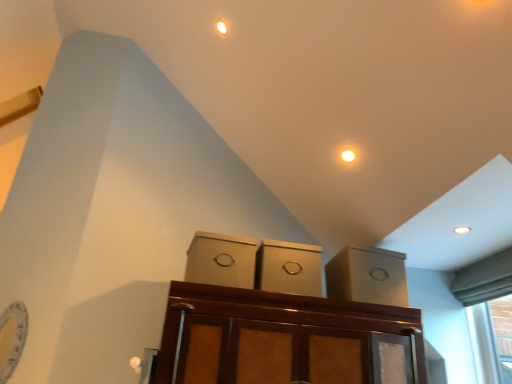
Question: Looking at their shapes, would you say matte cardboard box at center, the 3th cabinetry viewed from the right, is wider or thinner than matte cardboard boxes at center, arranged as the 2th cabinetry when viewed from the left?

Choices:
 (A) wide
 (B) thin

Answer: (B)

Question: Is point (196, 246) closer or farther from the camera than point (270, 263)?

Choices:
 (A) farther
 (B) closer

Answer: (A)

Question: Based on their relative distances, which object is nearer to the matte cardboard box at center, acting as the third cabinetry starting from the left?

Choices:
 (A) matte cardboard boxes at center, arranged as the 2th cabinetry when viewed from the left
 (B) matte cardboard box at center, acting as the first cabinetry starting from the left

Answer: (A)

Question: Estimate the real-world distances between objects in this image. Which object is farther from the matte cardboard box at center, acting as the third cabinetry starting from the left?

Choices:
 (A) matte cardboard box at center, the 3th cabinetry viewed from the right
 (B) matte cardboard boxes at center, arranged as the 2th cabinetry when viewed from the left

Answer: (A)